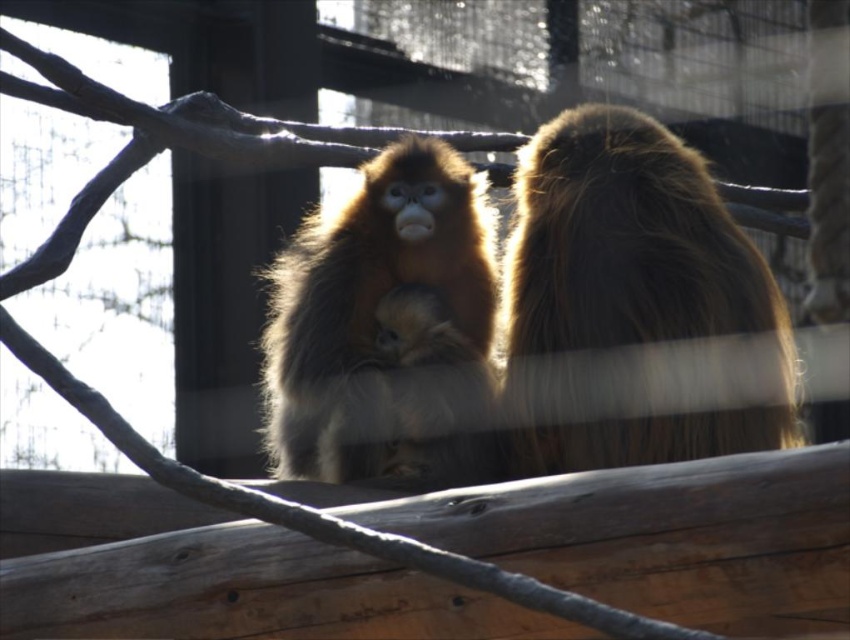
Question: Can you confirm if fuzzy brown monkey at right is wider than fuzzy golden monkey at center?

Choices:
 (A) no
 (B) yes

Answer: (B)

Question: Can you confirm if fuzzy brown monkey at right is positioned below fuzzy golden monkey at center?

Choices:
 (A) no
 (B) yes

Answer: (A)

Question: Among these points, which one is farthest from the camera?

Choices:
 (A) (414, 388)
 (B) (425, 308)
 (C) (636, 400)

Answer: (B)

Question: Can you confirm if fuzzy brown monkey at right is positioned below fuzzy golden monkey at center?

Choices:
 (A) yes
 (B) no

Answer: (B)

Question: Which of the following is the closest to the observer?

Choices:
 (A) (748, 442)
 (B) (316, 464)

Answer: (A)

Question: Which of the following is the farthest from the observer?

Choices:
 (A) fuzzy golden monkey at center
 (B) golden fur monkey at center
 (C) fuzzy brown monkey at right

Answer: (A)